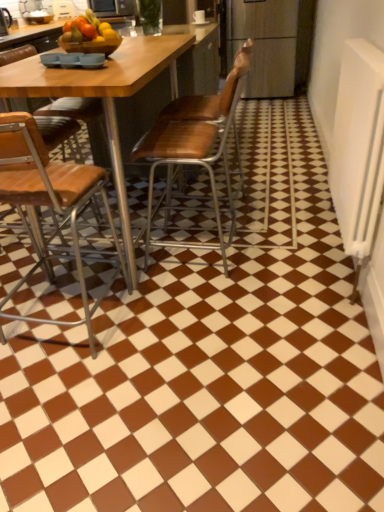
What is the approximate height of brown leather chair at left, acting as the third chair starting from the right?

brown leather chair at left, acting as the third chair starting from the right, is 38.97 inches in height.

How much space does wooden seat at center, which appears as the 1th chair when viewed from the right, occupy vertically?

wooden seat at center, which appears as the 1th chair when viewed from the right, is 38.66 inches in height.

At what (x,y) coordinates should I click in order to perform the action: click on brown leather chair at left, positioned as the 1th chair in left-to-right order. Please return your answer as a coordinate pair (x, y). This screenshot has height=512, width=384. Looking at the image, I should click on (51, 204).

Is brown leather chair at left, acting as the third chair starting from the right, facing away from wooden at center, the 2th chair from the right?

brown leather chair at left, acting as the third chair starting from the right, is not turned away from wooden at center, the 2th chair from the right.

Does brown leather chair at left, positioned as the 1th chair in left-to-right order, have a lesser height compared to wooden at center, which ranks as the second chair in left-to-right order?

Incorrect, the height of brown leather chair at left, positioned as the 1th chair in left-to-right order, does not fall short of that of wooden at center, which ranks as the second chair in left-to-right order.

Is brown leather chair at left, positioned as the 1th chair in left-to-right order, bigger than wooden at center, which ranks as the second chair in left-to-right order?

Yes, brown leather chair at left, positioned as the 1th chair in left-to-right order, is bigger than wooden at center, which ranks as the second chair in left-to-right order.

Is brown leather chair at left, positioned as the 1th chair in left-to-right order, oriented towards wooden seat at center, which appears as the 1th chair when viewed from the right?

Yes.

Looking at this image, is brown leather chair at left, acting as the third chair starting from the right, to the left or to the right of wooden seat at center, which appears as the 1th chair when viewed from the right, in the image?

In the image, brown leather chair at left, acting as the third chair starting from the right, appears on the left side of wooden seat at center, which appears as the 1th chair when viewed from the right.

Considering the sizes of objects brown leather chair at left, positioned as the 1th chair in left-to-right order, and wooden seat at center, which appears as the 1th chair when viewed from the right, in the image provided, who is thinner, brown leather chair at left, positioned as the 1th chair in left-to-right order, or wooden seat at center, which appears as the 1th chair when viewed from the right,?

brown leather chair at left, positioned as the 1th chair in left-to-right order.

From the image's perspective, which one is positioned higher, brown leather chair at left, acting as the third chair starting from the right, or wooden seat at center, which appears as the 1th chair when viewed from the right?

wooden seat at center, which appears as the 1th chair when viewed from the right, from the image's perspective.

In terms of size, does brown leather chair at left, acting as the third chair starting from the right, appear bigger or smaller than metallic microwave at upper center?

In the image, brown leather chair at left, acting as the third chair starting from the right, appears to be larger than metallic microwave at upper center.

Based on the photo, considering the positions of objects brown leather chair at left, positioned as the 1th chair in left-to-right order, and metallic microwave at upper center in the image provided, who is in front, brown leather chair at left, positioned as the 1th chair in left-to-right order, or metallic microwave at upper center?

brown leather chair at left, positioned as the 1th chair in left-to-right order, is closer to the camera.

Considering the positions of points (30, 119) and (95, 5), is point (30, 119) farther from camera compared to point (95, 5)?

No, it is in front of (95, 5).

From a real-world perspective, which object rests below the other?

brown leather chair at left, acting as the third chair starting from the right, from a real-world perspective.

Are metallic microwave at upper center and brown leather chair at left, acting as the third chair starting from the right, making contact?

metallic microwave at upper center is not next to brown leather chair at left, acting as the third chair starting from the right, and they're not touching.

Can you confirm if metallic microwave at upper center is thinner than brown leather chair at left, acting as the third chair starting from the right?

Indeed, metallic microwave at upper center has a lesser width compared to brown leather chair at left, acting as the third chair starting from the right.

Is the position of metallic microwave at upper center more distant than that of brown leather chair at left, acting as the third chair starting from the right?

Yes, metallic microwave at upper center is further from the camera.

Is wooden at center, which ranks as the second chair in left-to-right order, surrounded by metallic microwave at upper center?

Definitely not — wooden at center, which ranks as the second chair in left-to-right order, is not inside metallic microwave at upper center.

Who is smaller, metallic microwave at upper center or wooden at center, the 2th chair from the right?

metallic microwave at upper center is smaller.

Which of these two, metallic microwave at upper center or wooden at center, the 2th chair from the right, stands shorter?

Standing shorter between the two is metallic microwave at upper center.

Is point (118, 13) in front of point (225, 260)?

No.

Is metallic microwave at upper center not close to wooden seat at center, which appears as the 1th chair when viewed from the right?

Yes, metallic microwave at upper center is far from wooden seat at center, which appears as the 1th chair when viewed from the right.

Locate an element on the screen. This screenshot has height=512, width=384. appliance on the left side of wooden seat at center, which appears as the 1th chair when viewed from the right is located at coordinates (113, 8).

Considering their positions, is metallic microwave at upper center located in front of or behind wooden seat at center, which is counted as the 3th chair, starting from the left?

In the image, metallic microwave at upper center appears behind wooden seat at center, which is counted as the 3th chair, starting from the left.

Which of these two, metallic microwave at upper center or wooden seat at center, which is counted as the 3th chair, starting from the left, is bigger?

wooden seat at center, which is counted as the 3th chair, starting from the left.

Is wooden at center, the 2th chair from the right, wider than brown leather chair at left, acting as the third chair starting from the right?

Indeed, wooden at center, the 2th chair from the right, has a greater width compared to brown leather chair at left, acting as the third chair starting from the right.

Considering the sizes of objects wooden at center, which ranks as the second chair in left-to-right order, and brown leather chair at left, positioned as the 1th chair in left-to-right order, in the image provided, who is smaller, wooden at center, which ranks as the second chair in left-to-right order, or brown leather chair at left, positioned as the 1th chair in left-to-right order,?

Smaller between the two is wooden at center, which ranks as the second chair in left-to-right order.

Which chair is the 1st one when counting from the right side of the brown leather chair at left, positioned as the 1th chair in left-to-right order? Please provide its 2D coordinates.

[(195, 143)]

From the image's perspective, count 1st chairs upward from the brown leather chair at left, acting as the third chair starting from the right, and point to it. Please provide its 2D coordinates.

[(195, 143)]

At what (x,y) coordinates should I click in order to perform the action: click on chair that is the 2nd object to the right of the brown leather chair at left, acting as the third chair starting from the right, starting at the anchor. Please return your answer as a coordinate pair (x, y). The width and height of the screenshot is (384, 512). Looking at the image, I should click on (193, 108).

From the image, which object appears to be farther from metallic microwave at upper center, wooden at center, the 2th chair from the right, or brown leather chair at left, acting as the third chair starting from the right?

brown leather chair at left, acting as the third chair starting from the right.

When comparing their distances from metallic microwave at upper center, does brown leather chair at left, positioned as the 1th chair in left-to-right order, or wooden seat at center, which appears as the 1th chair when viewed from the right, seem closer?

Based on the image, wooden seat at center, which appears as the 1th chair when viewed from the right, appears to be nearer to metallic microwave at upper center.

Considering their positions, is metallic microwave at upper center positioned further to wooden at center, the 2th chair from the right, than wooden seat at center, which is counted as the 3th chair, starting from the left?

metallic microwave at upper center lies further to wooden at center, the 2th chair from the right, than the other object.

Based on the photo, looking at the image, which one is located further to brown leather chair at left, acting as the third chair starting from the right, wooden at center, which ranks as the second chair in left-to-right order, or wooden seat at center, which appears as the 1th chair when viewed from the right?

The object further to brown leather chair at left, acting as the third chair starting from the right, is wooden seat at center, which appears as the 1th chair when viewed from the right.

From the image, which object appears to be nearer to wooden at center, which ranks as the second chair in left-to-right order, metallic microwave at upper center or brown leather chair at left, acting as the third chair starting from the right?

Among the two, brown leather chair at left, acting as the third chair starting from the right, is located nearer to wooden at center, which ranks as the second chair in left-to-right order.

Looking at the image, which one is located further to metallic microwave at upper center, wooden seat at center, which appears as the 1th chair when viewed from the right, or wooden at center, the 2th chair from the right?

wooden seat at center, which appears as the 1th chair when viewed from the right, is positioned further to the anchor metallic microwave at upper center.

Looking at this image, based on their spatial positions, is brown leather chair at left, acting as the third chair starting from the right, or metallic microwave at upper center further from wooden seat at center, which is counted as the 3th chair, starting from the left?

Answer: metallic microwave at upper center lies further to wooden seat at center, which is counted as the 3th chair, starting from the left, than the other object.

Looking at the image, which one is located further to wooden seat at center, which appears as the 1th chair when viewed from the right, wooden at center, which ranks as the second chair in left-to-right order, or metallic microwave at upper center?

→ metallic microwave at upper center is positioned further to the anchor wooden seat at center, which appears as the 1th chair when viewed from the right.

You are a GUI agent. You are given a task and a screenshot of the screen. Output one action in this format:
    pyautogui.click(x=<x>, y=<y>)
    Task: Click on the chair between brown leather chair at left, acting as the third chair starting from the right, and wooden seat at center, which appears as the 1th chair when viewed from the right, from front to back
    The width and height of the screenshot is (384, 512).
    Given the screenshot: What is the action you would take?
    pyautogui.click(x=195, y=143)

Locate an element on the screen. chair between wooden at center, the 2th chair from the right, and metallic microwave at upper center, along the z-axis is located at coordinates (193, 108).